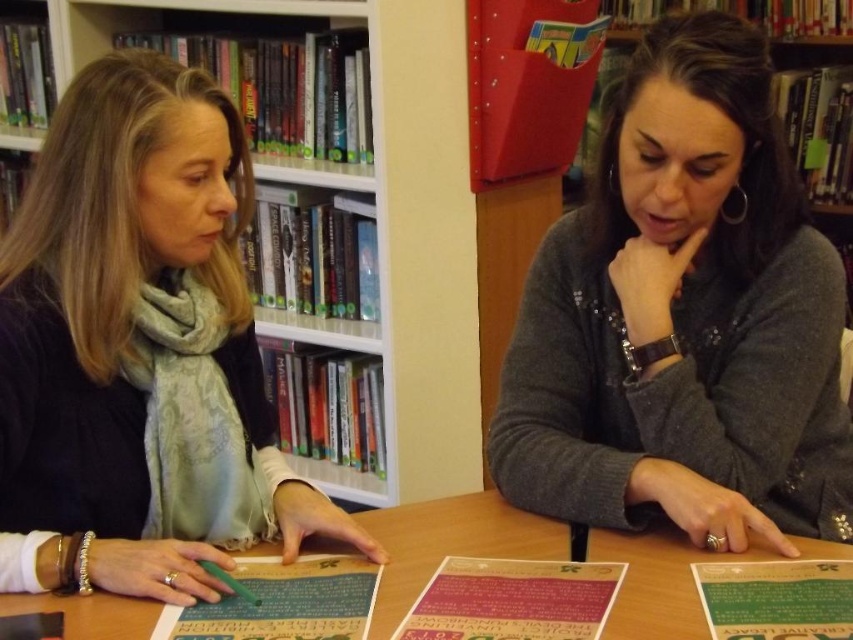
Question: Which object is farther from the camera taking this photo?

Choices:
 (A) green plastic pen at lower left
 (B) matte pink paper at center
 (C) matte black sweater at left

Answer: (C)

Question: Does green plastic pen at lower left have a lesser width compared to green paper at center?

Choices:
 (A) yes
 (B) no

Answer: (B)

Question: Observing the image, what is the correct spatial positioning of smooth wooden table at center in reference to matte pink paper at center?

Choices:
 (A) above
 (B) below

Answer: (A)

Question: Can you confirm if gray matte sweater at center is positioned to the left of matte pink paper at center?

Choices:
 (A) yes
 (B) no

Answer: (B)

Question: Which of the following is the farthest from the observer?

Choices:
 (A) [x=784, y=632]
 (B) [x=605, y=349]
 (C) [x=683, y=625]
 (D) [x=242, y=577]

Answer: (B)

Question: Considering the real-world distances, which object is closest to the matte black sweater at left?

Choices:
 (A) green plastic pen at lower left
 (B) smooth wooden table at center
 (C) gray matte sweater at center
 (D) matte pink paper at center

Answer: (A)